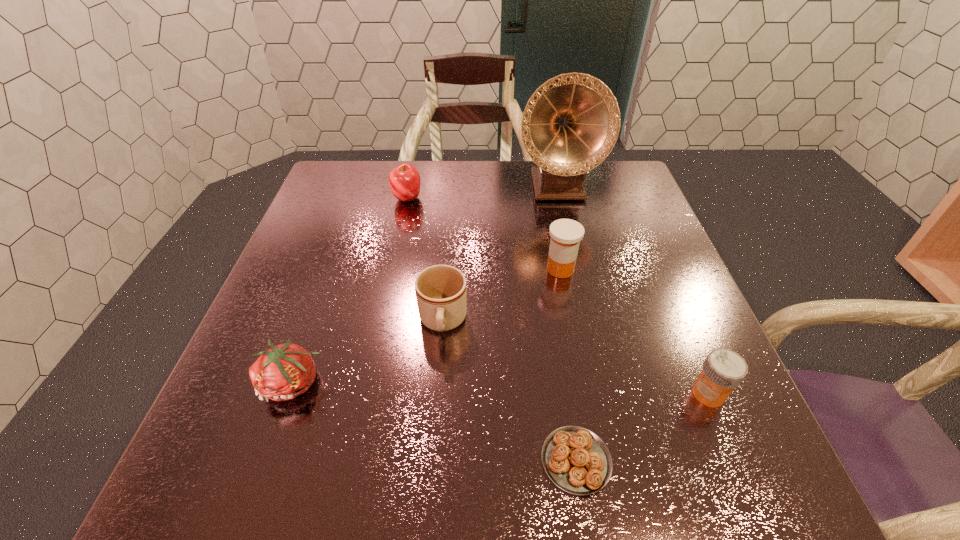
Where is `free spot at the near edge of the desktop`? Image resolution: width=960 pixels, height=540 pixels. free spot at the near edge of the desktop is located at coordinates (529, 476).

You are a GUI agent. You are given a task and a screenshot of the screen. Output one action in this format:
    pyautogui.click(x=<x>, y=<y>)
    Task: Click on the free space at the right edge
    
    Given the screenshot: What is the action you would take?
    pyautogui.click(x=633, y=241)

Locate an element on the screen. The height and width of the screenshot is (540, 960). vacant space at the far right corner of the desktop is located at coordinates (627, 206).

The height and width of the screenshot is (540, 960). In the image, there is a desktop. Find the location of `free space at the near right corner`. free space at the near right corner is located at coordinates (679, 489).

This screenshot has height=540, width=960. In order to click on unoccupied area between the nearer medicine and the second object from left to right in this screenshot , I will do `click(558, 296)`.

Find the location of a particular element. vacant area that lies between the pastry and the tallest object is located at coordinates (566, 323).

Image resolution: width=960 pixels, height=540 pixels. What are the coordinates of `vacant area that lies between the nearest object and the tomato` in the screenshot? It's located at (434, 422).

Locate an element on the screen. This screenshot has height=540, width=960. vacant space that is in between the rightmost object and the fifth object from right to left is located at coordinates (576, 358).

In order to click on vacant area that lies between the fourth farthest object and the third farthest object in this screenshot , I will do `click(501, 295)`.

Locate an element on the screen. This screenshot has width=960, height=540. vacant space that is in between the tallest object and the shorter medicine is located at coordinates (633, 291).